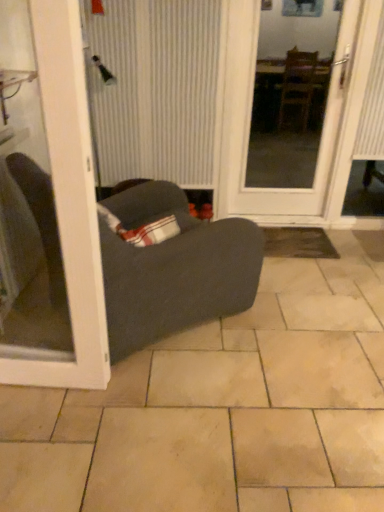
Question: Does white glossy door at center, which is the 2th door in front-to-back order, come behind dark gray fabric studio couch at center?

Choices:
 (A) no
 (B) yes

Answer: (B)

Question: Does white glossy door at center, the 1th door when ordered from back to front, have a lesser height compared to dark gray fabric studio couch at center?

Choices:
 (A) no
 (B) yes

Answer: (A)

Question: Is white glossy door at center, which is the 2th door in front-to-back order, in contact with dark gray fabric studio couch at center?

Choices:
 (A) no
 (B) yes

Answer: (A)

Question: Can you confirm if white glossy door at center, the 1th door when ordered from back to front, is taller than dark gray fabric studio couch at center?

Choices:
 (A) yes
 (B) no

Answer: (A)

Question: Is dark gray fabric studio couch at center located within white glossy door at center, the second door positioned from the left?

Choices:
 (A) no
 (B) yes

Answer: (A)

Question: From a real-world perspective, is white glossy door at center, the 1th door when ordered from back to front, over dark gray fabric studio couch at center?

Choices:
 (A) no
 (B) yes

Answer: (B)

Question: Can you confirm if dark gray fabric studio couch at center is taller than beige ceramic tile at center?

Choices:
 (A) yes
 (B) no

Answer: (A)

Question: Is beige ceramic tile at center located within dark gray fabric studio couch at center?

Choices:
 (A) no
 (B) yes

Answer: (A)

Question: From the image's perspective, is dark gray fabric studio couch at center on top of beige ceramic tile at center?

Choices:
 (A) no
 (B) yes

Answer: (B)

Question: Is dark gray fabric studio couch at center turned away from beige ceramic tile at center?

Choices:
 (A) no
 (B) yes

Answer: (A)

Question: Does dark gray fabric studio couch at center lie behind beige ceramic tile at center?

Choices:
 (A) no
 (B) yes

Answer: (B)

Question: Does dark gray fabric studio couch at center appear on the left side of beige ceramic tile at center?

Choices:
 (A) no
 (B) yes

Answer: (B)

Question: Does beige ceramic tile at center lie in front of white glossy door at left, placed as the second door when sorted from right to left?

Choices:
 (A) yes
 (B) no

Answer: (B)